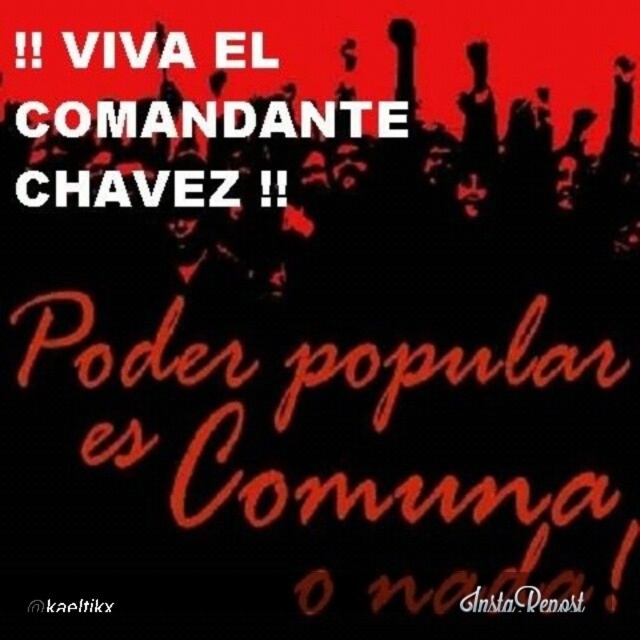
This screenshot has height=640, width=640. Find the location of `white text at upper left`. white text at upper left is located at coordinates (129, 49).

Does white text at upper left have a greater height compared to black instarepost at upper center?

Yes.

Is point (92, 52) behind point (563, 604)?

Yes, it is.

I want to click on white text at upper left, so click(129, 49).

Does black instarepost at upper center have a greater width compared to black text at upper center?

Yes.

Is black instarepost at upper center above black text at upper center?

Indeed, black instarepost at upper center is positioned over black text at upper center.

Between point (557, 611) and point (99, 604), which one is positioned in front?

Point (99, 604) is in front.

Image resolution: width=640 pixels, height=640 pixels. In order to click on black instarepost at upper center in this screenshot , I will do `click(524, 600)`.

Looking at this image, is white text at upper left to the left of black text at upper center from the viewer's perspective?

Incorrect, white text at upper left is not on the left side of black text at upper center.

From the picture: Measure the distance between point (35, 67) and camera.

2.48 meters

Does point (116, 48) come farther from viewer compared to point (33, 600)?

Yes, point (116, 48) is behind point (33, 600).

Where is `white text at upper left`? The height and width of the screenshot is (640, 640). white text at upper left is located at coordinates (129, 49).